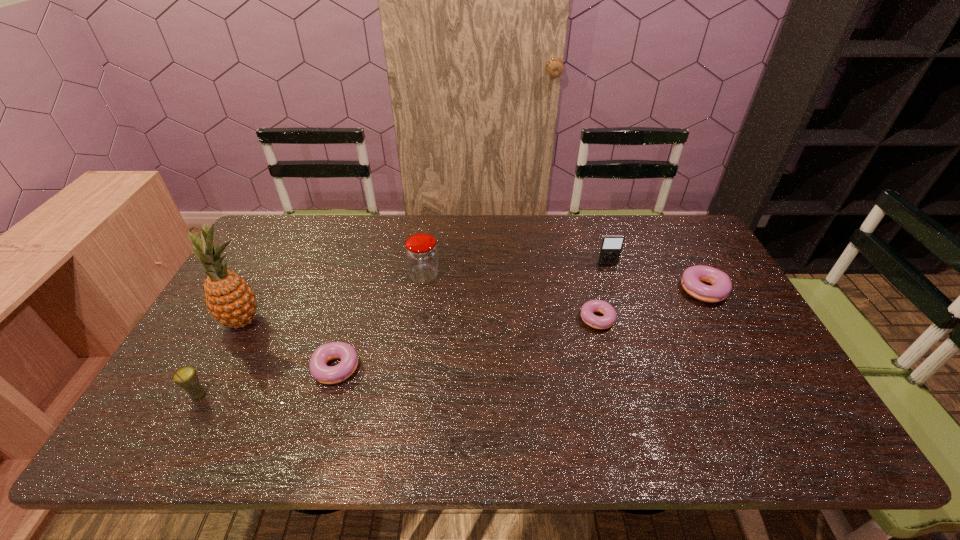
Image resolution: width=960 pixels, height=540 pixels. I want to click on spot to insert another doughnut for uniform distribution, so click(475, 341).